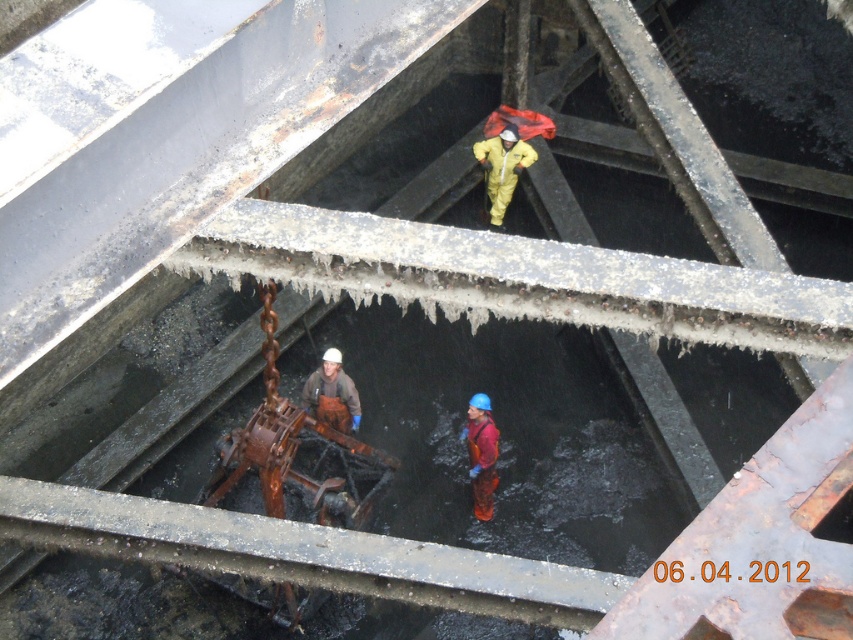
Can you confirm if yellow matte suit at center is positioned to the left of red rubber suit at center?

No, yellow matte suit at center is not to the left of red rubber suit at center.

Who is lower down, yellow matte suit at center or red rubber suit at center?

red rubber suit at center is below.

Consider the image. Who is more distant from viewer, (500,168) or (485,401)?

Positioned behind is point (500,168).

Identify the location of yellow matte suit at center. (502, 168).

Does yellow matte suit at center appear on the right side of brown leather boots at center?

Indeed, yellow matte suit at center is positioned on the right side of brown leather boots at center.

Measure the distance from yellow matte suit at center to brown leather boots at center.

The distance of yellow matte suit at center from brown leather boots at center is 7.22 feet.

Which is behind, point (500, 196) or point (331, 368)?

The point (500, 196) is more distant.

Where is `yellow matte suit at center`? Image resolution: width=853 pixels, height=640 pixels. yellow matte suit at center is located at coordinates (502, 168).

Is brown leather boots at center shorter than red rubber suit at center?

Yes, brown leather boots at center is shorter than red rubber suit at center.

The height and width of the screenshot is (640, 853). Describe the element at coordinates (332, 394) in the screenshot. I see `brown leather boots at center` at that location.

Image resolution: width=853 pixels, height=640 pixels. What do you see at coordinates (332, 394) in the screenshot? I see `brown leather boots at center` at bounding box center [332, 394].

The image size is (853, 640). I want to click on brown leather boots at center, so click(332, 394).